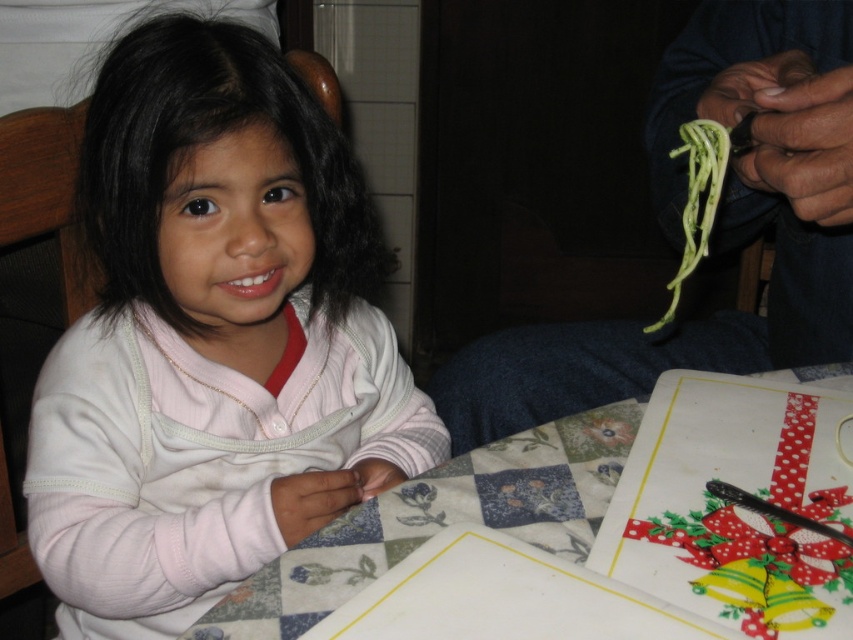
From the picture: Does pink fleece sweater at center appear on the left side of green matte spaghetti at upper right?

Correct, you'll find pink fleece sweater at center to the left of green matte spaghetti at upper right.

Who is positioned more to the left, pink fleece sweater at center or green matte spaghetti at upper right?

pink fleece sweater at center

Does point (225, 234) come behind point (669, 154)?

Yes, it is behind point (669, 154).

In order to click on pink fleece sweater at center in this screenshot , I will do `click(212, 340)`.

Which is below, pink fleece sweater at center or white fabric table at center?

white fabric table at center

Is point (61, 582) positioned in front of point (596, 465)?

That is False.

Image resolution: width=853 pixels, height=640 pixels. Identify the location of pink fleece sweater at center. (212, 340).

Is white fabric table at center above green matte spaghetti at upper right?

Actually, white fabric table at center is below green matte spaghetti at upper right.

Is point (258, 618) closer to camera compared to point (706, 202)?

Yes, it is.

Which is behind, point (601, 509) or point (695, 136)?

Point (695, 136)

Image resolution: width=853 pixels, height=640 pixels. Identify the location of white fabric table at center. (442, 518).